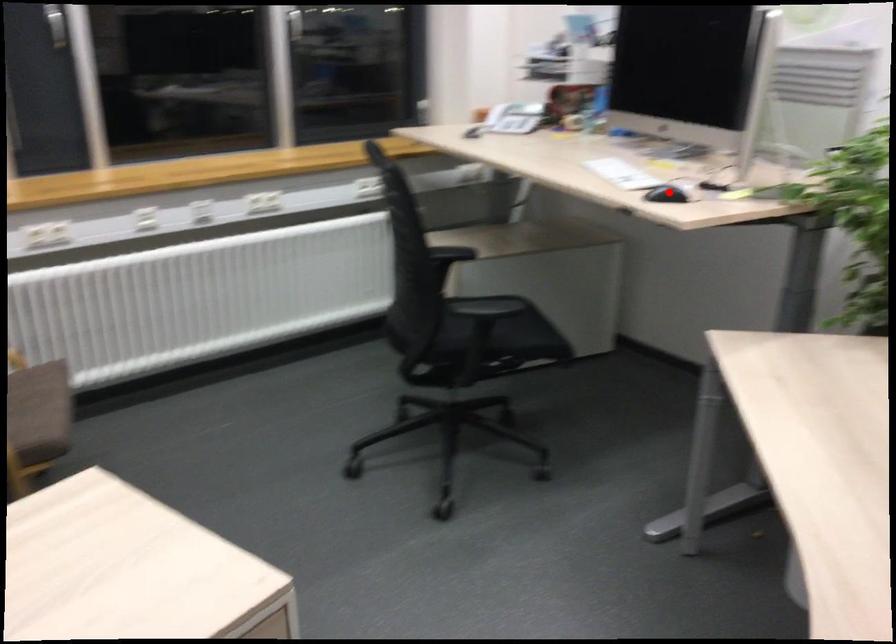
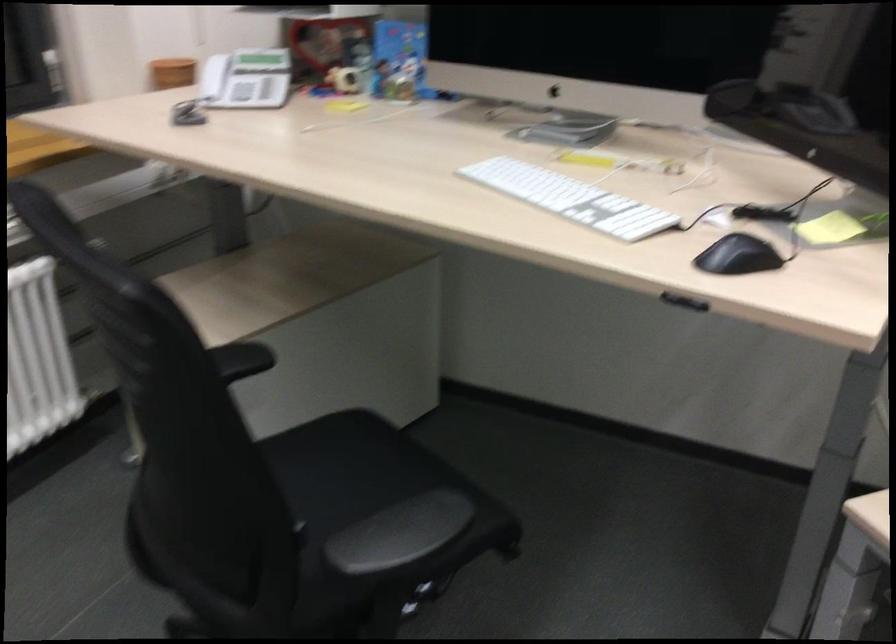
Question: I am providing you with two images of the same scene from different viewpoints. A red point is shown in image1. For the corresponding object point in image2, is it positioned nearer or farther from the camera?

Choices:
 (A) Nearer
 (B) Farther

Answer: (A)